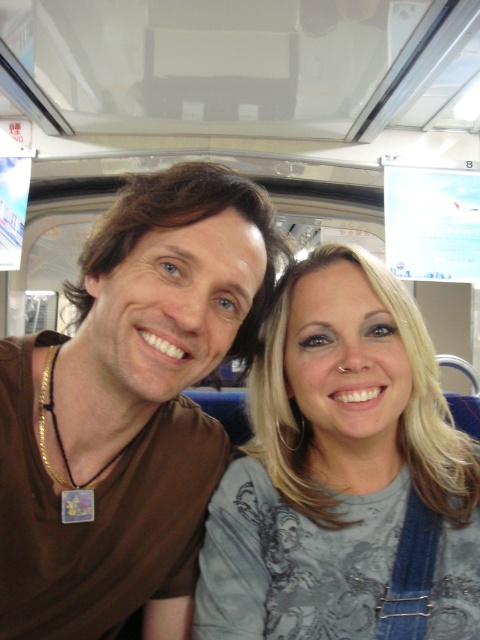
You are standing in front of a public transportation vehicle and want to reach a specific point marked at coordinates point [162,467]. If your arm can extend 28 inches, can you comfortably reach that point?

The point [162,467] is 30.95 inches away from the viewer. Since your arm can only extend 28 inches, you cannot comfortably reach that point.

You are standing at the back of the public transportation vehicle and want to move towards the front. Which point, point(236, 349) or point(385, 609), is closer to the front?

Point(236, 349) is behind point(385, 609), so point(385, 609) is closer to the front.

You are a tailor trying to fit a customer for a new shirt. You observe the brown matte shirt at center and the gray fabric shirt at center. Which shirt has a smaller width?

The brown matte shirt at center has a lesser width compared to the gray fabric shirt at center.